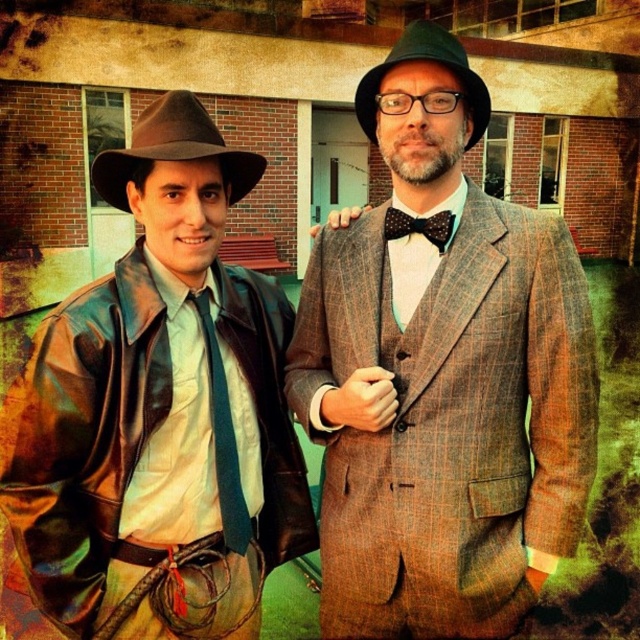
You are trying to decide which outfit to choose for a formal event. Both the plaid wool suit at center and the leather jacket at left are available. Considering their sizes, which one might be more suitable for someone who prefers a more voluminous look?

The plaid wool suit at center is larger in width than the leather jacket at left, making it more suitable for someone who prefers a voluminous look.

You are a photographer setting up a photo shoot for two models dressed in the plaid wool suit at center and the black dotted fabric bow tie at center. You want to ensure that both outfits are clearly visible in the frame. Which outfit should you focus on first to avoid blurring due to size differences?

The plaid wool suit at center is larger in size than the black dotted fabric bow tie at center, so you should focus on the plaid wool suit at center first to ensure clarity, as it occupies more space in the frame.

You are a photographer trying to capture both the plaid wool suit at center and the brown leather fedora at left in a single frame. Based on their sizes, which object should you focus on to ensure both are in the frame without cropping?

The plaid wool suit at center is bigger than the brown leather fedora at left, so you should focus on the plaid wool suit at center to ensure both are in the frame without cropping.